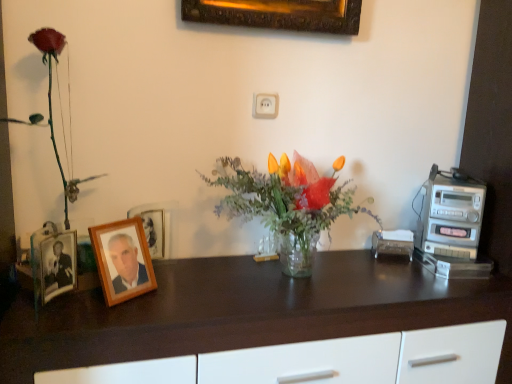
You are a GUI agent. You are given a task and a screenshot of the screen. Output one action in this format:
    pyautogui.click(x=<x>, y=<y>)
    Task: Click on the wooden picture frame at left, acting as the second picture frame starting from the front
    
    Given the screenshot: What is the action you would take?
    pyautogui.click(x=155, y=226)

The height and width of the screenshot is (384, 512). I want to click on wooden photo frame at left, the 2th picture frame when ordered from back to front, so click(x=122, y=260).

In order to click on dark wood desk at center in this screenshot , I will do `click(246, 311)`.

This screenshot has width=512, height=384. I want to click on wooden picture frame at left, acting as the second picture frame starting from the front, so click(155, 226).

Is matte plastic rose at left at the right side of wooden picture frame at left, arranged as the first picture frame when viewed from the back?

Incorrect, matte plastic rose at left is not on the right side of wooden picture frame at left, arranged as the first picture frame when viewed from the back.

Does matte plastic rose at left have a larger size compared to wooden picture frame at left, arranged as the first picture frame when viewed from the back?

Indeed, matte plastic rose at left has a larger size compared to wooden picture frame at left, arranged as the first picture frame when viewed from the back.

The image size is (512, 384). I want to click on the 2nd picture frame directly beneath the matte plastic rose at left (from a real-world perspective), so click(155, 226).

Which of these two, clear glass vase at center or matte plastic rose at left, is wider?

clear glass vase at center.

From the image's perspective, would you say clear glass vase at center is shown under matte plastic rose at left?

Yes, from the image's perspective, clear glass vase at center is beneath matte plastic rose at left.

The image size is (512, 384). In order to click on houseplant below the matte plastic rose at left (from the image's perspective) in this screenshot , I will do `click(285, 204)`.

Considering the relative sizes of silver metallic stereo at right and wooden picture frame at left, acting as the second picture frame starting from the front, in the image provided, is silver metallic stereo at right bigger than wooden picture frame at left, acting as the second picture frame starting from the front,?

Indeed, silver metallic stereo at right has a larger size compared to wooden picture frame at left, acting as the second picture frame starting from the front.

Identify the location of picture frame that is the 1st one when counting downward from the silver metallic stereo at right (from the image's perspective). (155, 226).

Between silver metallic stereo at right and wooden picture frame at left, arranged as the first picture frame when viewed from the back, which one has more height?

With more height is silver metallic stereo at right.

Is silver metallic stereo at right positioned far away from wooden picture frame at left, acting as the second picture frame starting from the front?

Actually, silver metallic stereo at right and wooden picture frame at left, acting as the second picture frame starting from the front, are a little close together.

Considering the sizes of silver metallic stereo at right and dark wood desk at center in the image, is silver metallic stereo at right wider or thinner than dark wood desk at center?

In the image, silver metallic stereo at right appears to be more narrow than dark wood desk at center.

Is dark wood desk at center surrounded by silver metallic stereo at right?

No, dark wood desk at center is located outside of silver metallic stereo at right.

Where is `desk that appears in front of the silver metallic stereo at right`? Image resolution: width=512 pixels, height=384 pixels. desk that appears in front of the silver metallic stereo at right is located at coordinates (246, 311).

In the image, is silver metallic stereo at right on the left side or the right side of dark wood desk at center?

Clearly, silver metallic stereo at right is on the right of dark wood desk at center in the image.

Considering the positions of point (139, 306) and point (141, 209), is point (139, 306) closer or farther from the camera than point (141, 209)?

Point (139, 306) is positioned closer to the camera compared to point (141, 209).

Consider the image. Between dark wood desk at center and wooden picture frame at left, arranged as the first picture frame when viewed from the back, which one has smaller width?

wooden picture frame at left, arranged as the first picture frame when viewed from the back.

Is dark wood desk at center further to camera compared to wooden picture frame at left, arranged as the first picture frame when viewed from the back?

No, it is not.

Consider the image. Is silver metallic stereo at right far away from wooden photo frame at left, the first picture frame when ordered from front to back?

silver metallic stereo at right is near wooden photo frame at left, the first picture frame when ordered from front to back, not far away.

Which object is closer to the camera taking this photo, silver metallic stereo at right or wooden photo frame at left, the 2th picture frame when ordered from back to front?

Positioned in front is wooden photo frame at left, the 2th picture frame when ordered from back to front.

Could wooden photo frame at left, the first picture frame when ordered from front to back, be considered to be inside silver metallic stereo at right?

That's incorrect, wooden photo frame at left, the first picture frame when ordered from front to back, is not inside silver metallic stereo at right.

From the image's perspective, who appears lower, silver metallic stereo at right or wooden photo frame at left, the first picture frame when ordered from front to back?

wooden photo frame at left, the first picture frame when ordered from front to back.

Between silver metallic stereo at right and matte plastic rose at left, which one has smaller size?

silver metallic stereo at right.

From a real-world perspective, is silver metallic stereo at right positioned under matte plastic rose at left based on gravity?

Indeed, from a real-world perspective, silver metallic stereo at right is positioned beneath matte plastic rose at left.

Considering the positions of objects silver metallic stereo at right and matte plastic rose at left in the image provided, who is in front, silver metallic stereo at right or matte plastic rose at left?

matte plastic rose at left is more forward.

Considering the relative sizes of silver metallic stereo at right and matte plastic rose at left in the image provided, is silver metallic stereo at right wider than matte plastic rose at left?

Yes.

From the image's perspective, which picture frame is the 1st one below the matte plastic rose at left? Please provide its 2D coordinates.

[(155, 226)]

This screenshot has width=512, height=384. I want to click on floral arrangement on the left side of clear glass vase at center, so click(51, 103).

Based on their spatial positions, is matte plastic rose at left or wooden photo frame at left, the 2th picture frame when ordered from back to front, further from silver metallic stereo at right?

matte plastic rose at left is further to silver metallic stereo at right.

Looking at the image, which one is located further to silver metallic stereo at right, wooden photo frame at left, the first picture frame when ordered from front to back, or dark wood desk at center?

wooden photo frame at left, the first picture frame when ordered from front to back, is further to silver metallic stereo at right.

Consider the image. Based on their spatial positions, is wooden photo frame at left, the first picture frame when ordered from front to back, or silver metallic stereo at right closer to clear glass vase at center?

Based on the image, wooden photo frame at left, the first picture frame when ordered from front to back, appears to be nearer to clear glass vase at center.

When comparing their distances from dark wood desk at center, does clear glass vase at center or silver metallic stereo at right seem closer?

clear glass vase at center.

When comparing their distances from silver metallic stereo at right, does wooden picture frame at left, acting as the second picture frame starting from the front, or clear glass vase at center seem closer?

clear glass vase at center is positioned closer to the anchor silver metallic stereo at right.

Considering their positions, is dark wood desk at center positioned closer to silver metallic stereo at right than wooden photo frame at left, the first picture frame when ordered from front to back?

The object closer to silver metallic stereo at right is dark wood desk at center.

Looking at the image, which one is located further to clear glass vase at center, silver metallic stereo at right or dark wood desk at center?

silver metallic stereo at right.

Looking at the image, which one is located further to dark wood desk at center, clear glass vase at center or wooden photo frame at left, the first picture frame when ordered from front to back?

wooden photo frame at left, the first picture frame when ordered from front to back, is further to dark wood desk at center.

Identify the location of desk between wooden picture frame at left, arranged as the first picture frame when viewed from the back, and silver metallic stereo at right. (246, 311).

You are a GUI agent. You are given a task and a screenshot of the screen. Output one action in this format:
    pyautogui.click(x=<x>, y=<y>)
    Task: Click on the picture frame between wooden picture frame at left, arranged as the first picture frame when viewed from the back, and dark wood desk at center from top to bottom
    The image size is (512, 384).
    Given the screenshot: What is the action you would take?
    pyautogui.click(x=122, y=260)

Find the location of a particular element. picture frame between wooden photo frame at left, the first picture frame when ordered from front to back, and silver metallic stereo at right is located at coordinates (155, 226).

Identify the location of houseplant located between wooden photo frame at left, the first picture frame when ordered from front to back, and silver metallic stereo at right in the left-right direction. coord(285,204).